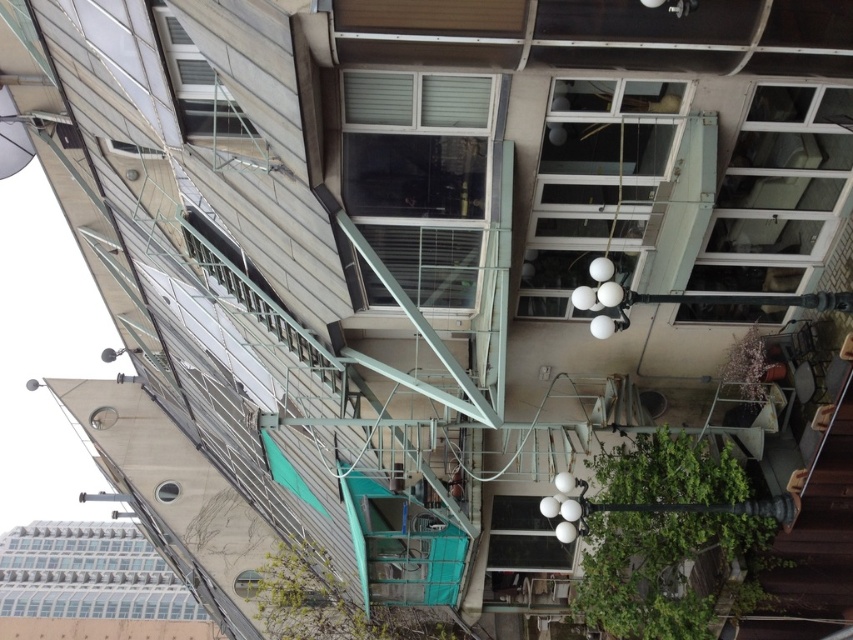
You are standing in front of the multi story building and want to determine the relative positions of two points marked on the building. Which point is closer to you, the point at coordinate (x=297, y=625) or the point at (x=735, y=365)?

The point at coordinate (x=297, y=625) is closer to you because it is further to the viewer than the point at (x=735, y=365).

You are standing at the base of the building and looking up at the two points marked on the structure. Which point, point (596, 547) or point (258, 605), is closer to your eyes?

Point (596, 547) is closer to the camera than point (258, 605), so it would appear closer to your eyes.